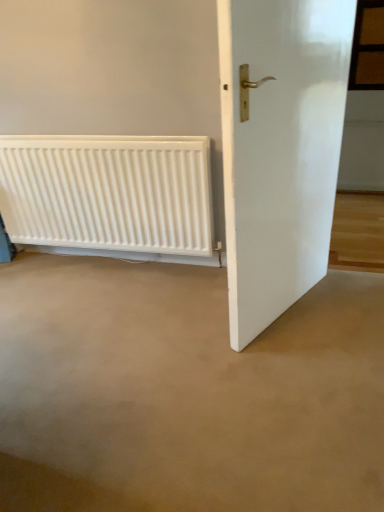
Question: Is white matte radiator at lower left in front of white glossy door at right?

Choices:
 (A) yes
 (B) no

Answer: (B)

Question: Is white matte radiator at lower left thinner than white glossy door at right?

Choices:
 (A) no
 (B) yes

Answer: (B)

Question: Is white matte radiator at lower left far away from white glossy door at right?

Choices:
 (A) yes
 (B) no

Answer: (B)

Question: Is white matte radiator at lower left to the left of white glossy door at right from the viewer's perspective?

Choices:
 (A) yes
 (B) no

Answer: (A)

Question: Can you confirm if white matte radiator at lower left is positioned to the right of white glossy door at right?

Choices:
 (A) yes
 (B) no

Answer: (B)

Question: From a real-world perspective, relative to white matte radiator at lower left, is white glossy door at right vertically above or below?

Choices:
 (A) below
 (B) above

Answer: (B)

Question: From the image's perspective, is white glossy door at right above or below white matte radiator at lower left?

Choices:
 (A) above
 (B) below

Answer: (B)

Question: Is white glossy door at right bigger or smaller than white matte radiator at lower left?

Choices:
 (A) small
 (B) big

Answer: (B)

Question: Is point (281, 96) closer or farther from the camera than point (61, 170)?

Choices:
 (A) closer
 (B) farther

Answer: (A)

Question: Visually, is white glossy door at right positioned to the left or to the right of brown wooden window at upper right?

Choices:
 (A) right
 (B) left

Answer: (B)

Question: Is white glossy door at right situated inside brown wooden window at upper right or outside?

Choices:
 (A) outside
 (B) inside

Answer: (A)

Question: From the image's perspective, is white glossy door at right positioned above or below brown wooden window at upper right?

Choices:
 (A) below
 (B) above

Answer: (A)

Question: Considering their positions, is white glossy door at right located in front of or behind brown wooden window at upper right?

Choices:
 (A) behind
 (B) front

Answer: (B)

Question: Looking at the image, does white matte radiator at lower left seem bigger or smaller compared to brown wooden window at upper right?

Choices:
 (A) small
 (B) big

Answer: (B)

Question: From the image's perspective, is white matte radiator at lower left positioned above or below brown wooden window at upper right?

Choices:
 (A) above
 (B) below

Answer: (B)